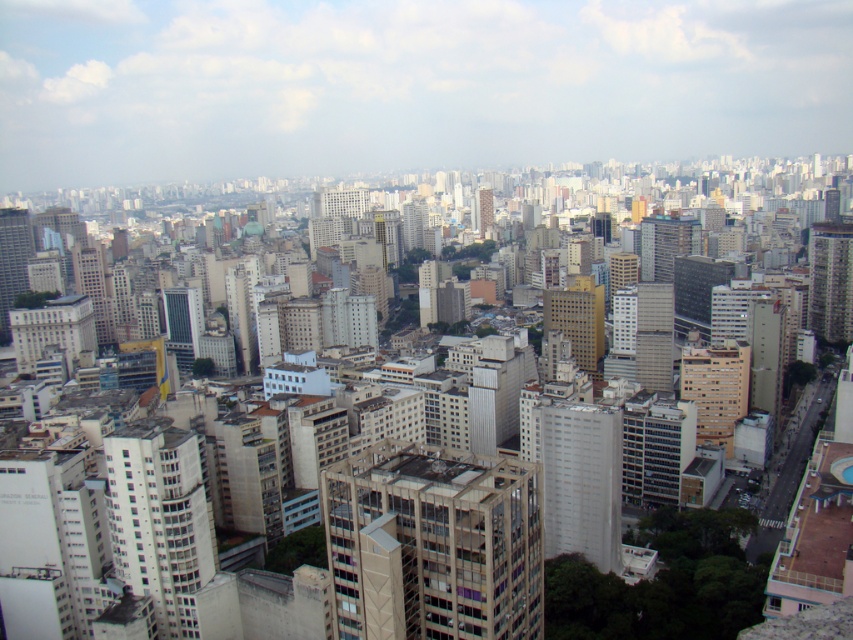
In the scene shown: Does beige concrete building at center appear on the right side of smooth gray building at right?

Incorrect, beige concrete building at center is not on the right side of smooth gray building at right.

Between point (508, 536) and point (827, 276), which one is positioned behind?

The point (827, 276) is behind.

The height and width of the screenshot is (640, 853). What are the coordinates of `beige concrete building at center` in the screenshot? It's located at (436, 541).

This screenshot has width=853, height=640. Describe the element at coordinates (12, 260) in the screenshot. I see `matte glass skyscraper at left` at that location.

This screenshot has width=853, height=640. Describe the element at coordinates (12, 260) in the screenshot. I see `matte glass skyscraper at left` at that location.

Locate an element on the screen. Image resolution: width=853 pixels, height=640 pixels. matte glass skyscraper at left is located at coordinates (12, 260).

Is white concrete building at lower left to the left of smooth beige tower at center from the viewer's perspective?

Yes, white concrete building at lower left is to the left of smooth beige tower at center.

Based on the photo, is white concrete building at lower left smaller than smooth beige tower at center?

No.

At what (x,y) coordinates should I click in order to perform the action: click on white concrete building at lower left. Please return your answer as a coordinate pair (x, y). Looking at the image, I should click on (160, 518).